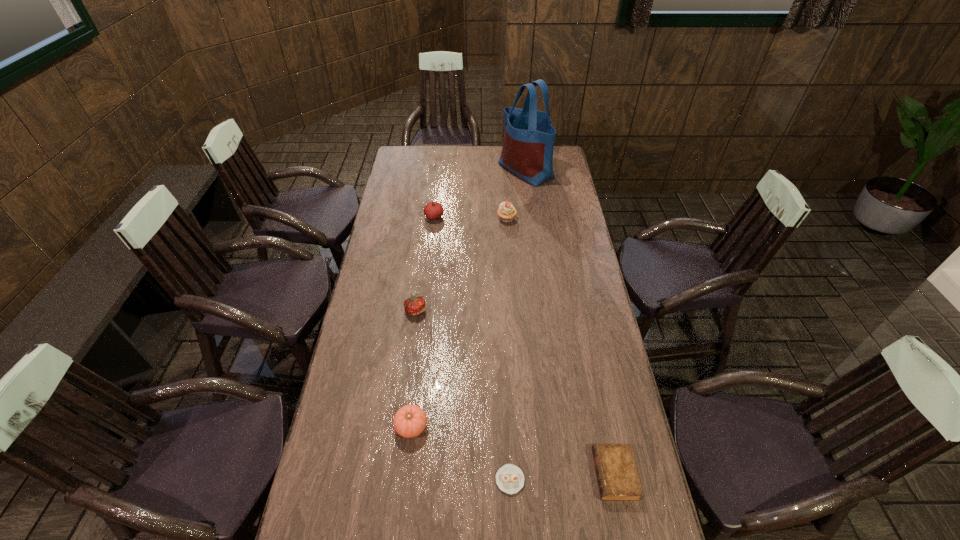
Find the location of a particular element. The image size is (960, 540). object at the far edge is located at coordinates coord(527,151).

I want to click on handbag positioned at the right edge, so click(x=527, y=151).

Find the location of a particular element. Image resolution: width=960 pixels, height=540 pixels. diary present at the right edge is located at coordinates (617, 476).

Find the location of a particular element. object that is at the far right corner is located at coordinates coord(527,151).

Locate an element on the screen. This screenshot has height=540, width=960. vacant space at the far edge of the desktop is located at coordinates 485,146.

Identify the location of vacant region at the left edge of the desktop. (368, 300).

In the image, there is a desktop. At what (x,y) coordinates should I click in order to perform the action: click on vacant space at the right edge. Please return your answer as a coordinate pair (x, y). The image size is (960, 540). Looking at the image, I should click on (562, 278).

At what (x,y) coordinates should I click in order to perform the action: click on vacant space at the far left corner of the desktop. Please return your answer as a coordinate pair (x, y). Looking at the image, I should click on (398, 152).

Where is `free area in between the third nearest object and the taller cupcake`? This screenshot has width=960, height=540. free area in between the third nearest object and the taller cupcake is located at coordinates (459, 323).

Image resolution: width=960 pixels, height=540 pixels. I want to click on unoccupied position between the shortest object and the farthest object, so click(518, 325).